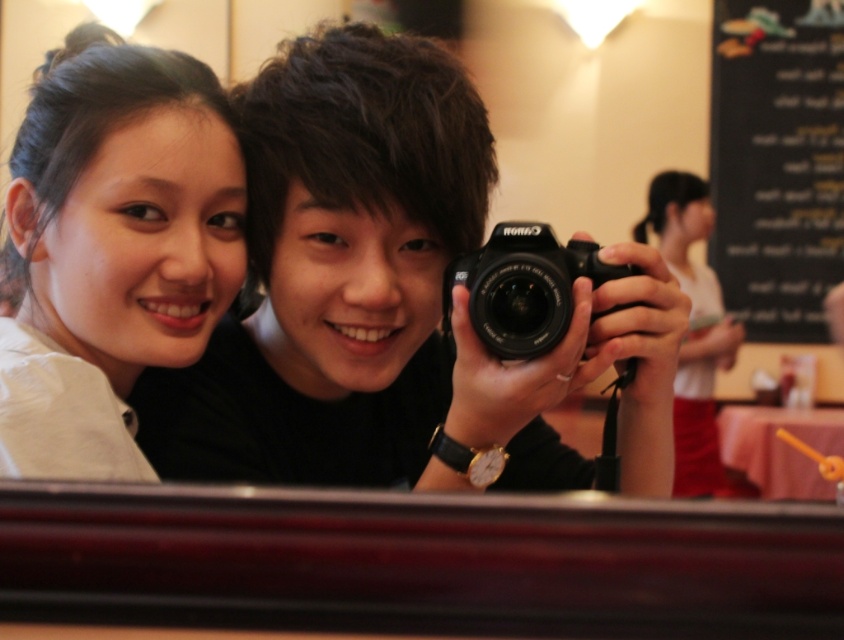
Question: Which point appears closest to the camera in this image?

Choices:
 (A) (537, 262)
 (B) (674, 436)
 (C) (723, 93)

Answer: (A)

Question: Is matte white shirt at left positioned at the back of white matte shirt at upper right?

Choices:
 (A) yes
 (B) no

Answer: (B)

Question: Which object is the farthest from the black chalkboard menu at upper right?

Choices:
 (A) black matte camera at center
 (B) white matte shirt at upper right
 (C) black plastic camera at center
 (D) matte white shirt at left

Answer: (C)

Question: Does black matte camera at center have a larger size compared to black plastic camera at center?

Choices:
 (A) yes
 (B) no

Answer: (A)

Question: Does matte white shirt at left have a smaller size compared to black plastic camera at center?

Choices:
 (A) yes
 (B) no

Answer: (B)

Question: Among these objects, which one is farthest from the camera?

Choices:
 (A) black chalkboard menu at upper right
 (B) black plastic camera at center
 (C) white matte shirt at upper right
 (D) black matte camera at center

Answer: (A)